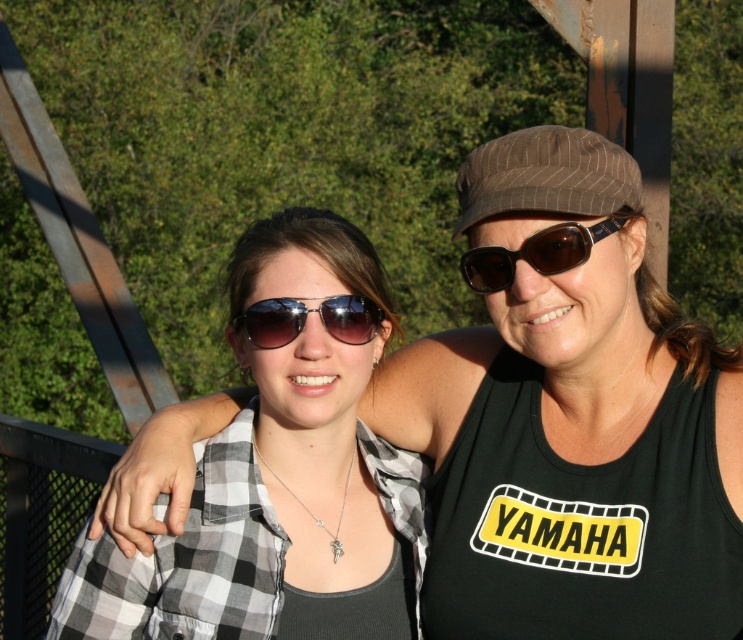
Question: Does black checkered shirt at center have a larger size compared to metallic reflective sunglasses at center?

Choices:
 (A) yes
 (B) no

Answer: (A)

Question: Can you confirm if checkered fabric shirt at center is positioned to the left of black fabric tank top at upper right?

Choices:
 (A) no
 (B) yes

Answer: (B)

Question: Where is black checkered shirt at center located in relation to metallic reflective sunglasses at center in the image?

Choices:
 (A) below
 (B) above

Answer: (A)

Question: Considering the real-world distances, which object is farthest from the black fabric tank top at upper right?

Choices:
 (A) metallic reflective sunglasses at center
 (B) black checkered shirt at center
 (C) brown reflective sunglasses at upper center
 (D) checkered fabric shirt at center

Answer: (A)

Question: Estimate the real-world distances between objects in this image. Which object is farther from the checkered fabric shirt at center?

Choices:
 (A) black fabric tank top at upper right
 (B) brown reflective sunglasses at upper center
 (C) brown pinstripe baseball cap at upper right
 (D) black checkered shirt at center

Answer: (C)

Question: Which of the following is the closest to the observer?

Choices:
 (A) (493, 177)
 (B) (473, 284)
 (C) (353, 317)
 (D) (493, 504)

Answer: (A)